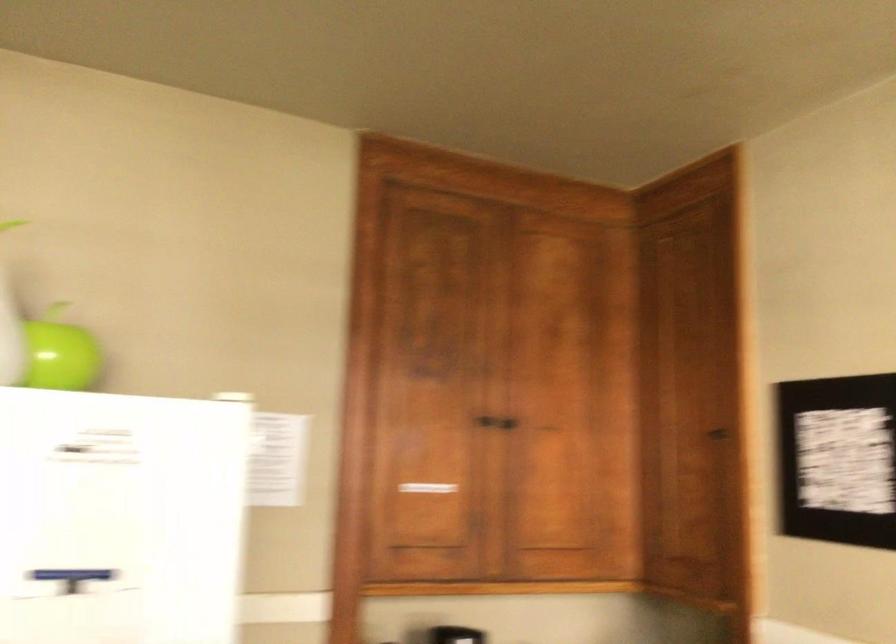
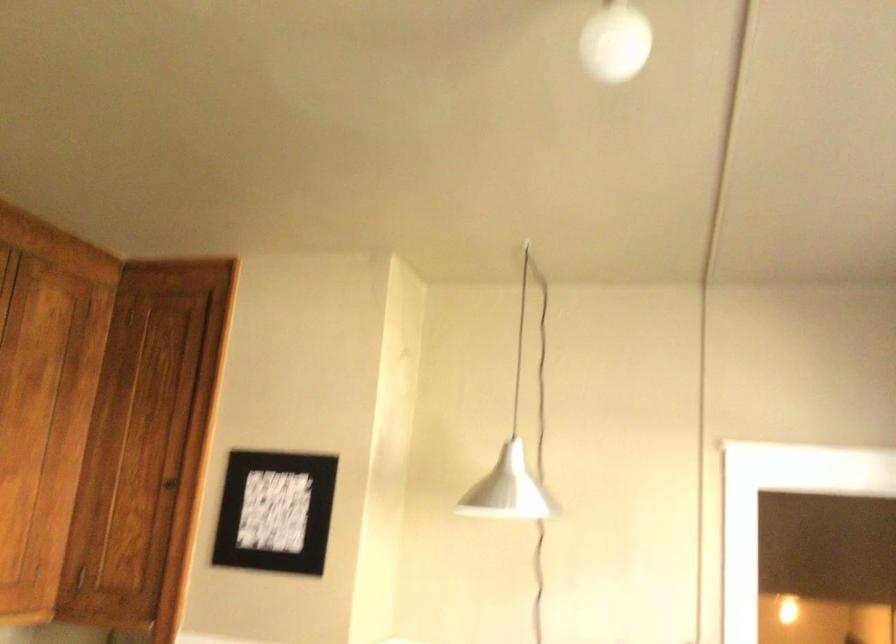
In the second image, find the point that corresponds to the point at 538,351 in the first image.

(23, 397)